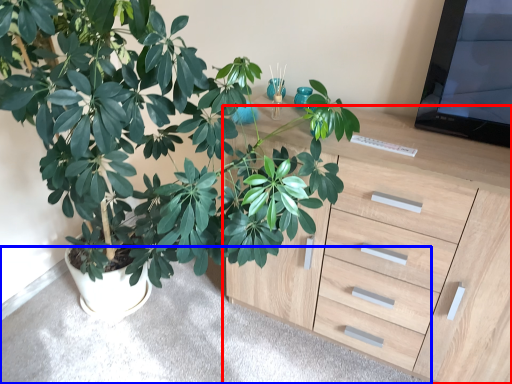
Question: Which object appears closest to the camera in this image, chest of drawers (highlighted by a red box) or gray (highlighted by a blue box)?

Choices:
 (A) chest of drawers
 (B) gray

Answer: (A)